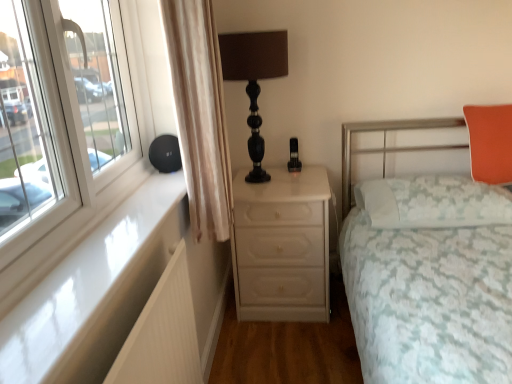
Question: Is the position of white lace pillow at right, which is counted as the 1th pillow, starting from the bottom, less distant than that of beige fabric curtain at left?

Choices:
 (A) no
 (B) yes

Answer: (A)

Question: Can you confirm if white lace pillow at right, which is counted as the 1th pillow, starting from the bottom, is positioned to the right of beige fabric curtain at left?

Choices:
 (A) no
 (B) yes

Answer: (B)

Question: Is the surface of white lace pillow at right, which is the second pillow in top-to-bottom order, in direct contact with beige fabric curtain at left?

Choices:
 (A) no
 (B) yes

Answer: (A)

Question: Considering the relative sizes of white lace pillow at right, which is counted as the 1th pillow, starting from the bottom, and beige fabric curtain at left in the image provided, is white lace pillow at right, which is counted as the 1th pillow, starting from the bottom, shorter than beige fabric curtain at left?

Choices:
 (A) no
 (B) yes

Answer: (B)

Question: Can you confirm if white lace pillow at right, which is the second pillow in top-to-bottom order, is bigger than beige fabric curtain at left?

Choices:
 (A) yes
 (B) no

Answer: (B)

Question: Is point (240, 281) closer or farther from the camera than point (188, 283)?

Choices:
 (A) farther
 (B) closer

Answer: (A)

Question: Relative to white ribbed radiator at lower left, is white glossy chest of drawers at center in front or behind?

Choices:
 (A) behind
 (B) front

Answer: (A)

Question: Is white glossy chest of drawers at center wider or thinner than white ribbed radiator at lower left?

Choices:
 (A) thin
 (B) wide

Answer: (B)

Question: Is white glossy chest of drawers at center situated inside white ribbed radiator at lower left or outside?

Choices:
 (A) inside
 (B) outside

Answer: (B)

Question: Would you say white lace pillow at right, which is counted as the 1th pillow, starting from the bottom, is to the left or to the right of beige fabric curtain at left in the picture?

Choices:
 (A) right
 (B) left

Answer: (A)

Question: Is white lace pillow at right, which is the second pillow in top-to-bottom order, bigger or smaller than beige fabric curtain at left?

Choices:
 (A) small
 (B) big

Answer: (A)

Question: Considering the positions of white lace pillow at right, which is counted as the 1th pillow, starting from the bottom, and beige fabric curtain at left in the image, is white lace pillow at right, which is counted as the 1th pillow, starting from the bottom, taller or shorter than beige fabric curtain at left?

Choices:
 (A) tall
 (B) short

Answer: (B)

Question: In the image, is white lace pillow at right, which is counted as the 1th pillow, starting from the bottom, positioned in front of or behind beige fabric curtain at left?

Choices:
 (A) behind
 (B) front

Answer: (A)

Question: Visually, is orange fabric pillow at upper right, acting as the first pillow starting from the top, positioned to the left or to the right of white lace pillow at right, which is counted as the 1th pillow, starting from the bottom?

Choices:
 (A) left
 (B) right

Answer: (B)

Question: From their relative heights in the image, would you say orange fabric pillow at upper right, the second pillow from the bottom, is taller or shorter than white lace pillow at right, which is the second pillow in top-to-bottom order?

Choices:
 (A) short
 (B) tall

Answer: (B)